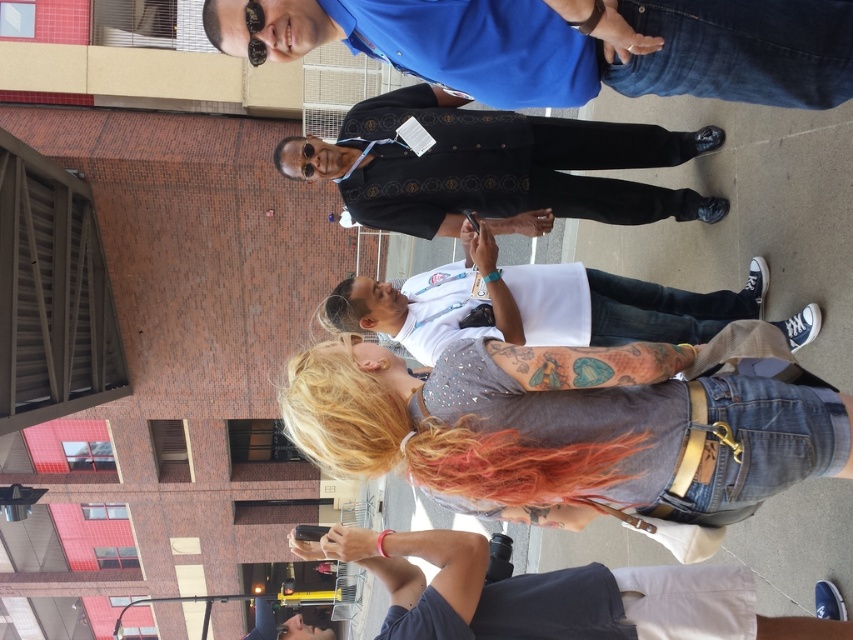
Looking at this image, you are a photographer trying to capture a group photo of the gray studded shirt at center and the blue shirt at upper center. Based on their positions, which person should you position closer to the camera to ensure both are in focus?

The gray studded shirt at center is much taller than the blue shirt at upper center, so you should position the gray studded shirt at center closer to the camera to ensure both are in focus.

You are a photographer trying to capture a group photo of the blue shirt at upper center and the matte black shirt at center. Based on their positions in the image, which person should you focus on first to ensure both are in frame?

The blue shirt at upper center should be focused on first since it is located above the matte black shirt at center, ensuring both are within the frame by starting from the top.